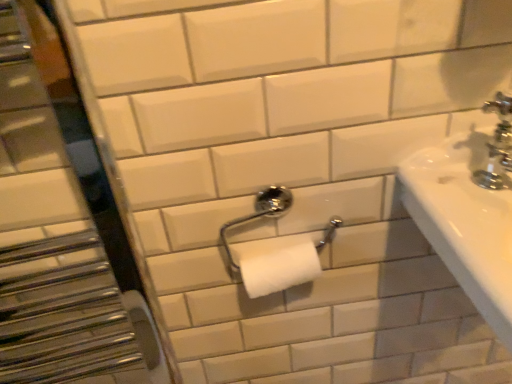
Where is `chrome metallic faucet at upper right`? Image resolution: width=512 pixels, height=384 pixels. chrome metallic faucet at upper right is located at coordinates (497, 145).

Is point (507, 139) in front of point (35, 355)?

That is True.

This screenshot has height=384, width=512. In order to click on mirror that appears below the chrome metallic faucet at upper right (from a real-world perspective) in this screenshot , I will do `click(64, 229)`.

Is chrome metallic faucet at upper right not within brushed metal mirror at left?

Yes, chrome metallic faucet at upper right is not within brushed metal mirror at left.

Is point (3, 35) positioned after point (489, 162)?

No, it is not.

Are brushed metal mirror at left and chrome metallic faucet at upper right beside each other?

No, brushed metal mirror at left is not touching chrome metallic faucet at upper right.

Is brushed metal mirror at left wider than chrome metallic faucet at upper right?

Correct, the width of brushed metal mirror at left exceeds that of chrome metallic faucet at upper right.

From a real-world perspective, which object stands above the other?

In real-world perspective, chrome metallic faucet at upper right is above.

From the image's perspective, between chrome metallic toilet paper holder at center and brushed metal mirror at left, which one is located above?

chrome metallic toilet paper holder at center.

Is chrome metallic toilet paper holder at center facing towards brushed metal mirror at left?

No, chrome metallic toilet paper holder at center is not aimed at brushed metal mirror at left.

Which is behind, chrome metallic toilet paper holder at center or brushed metal mirror at left?

chrome metallic toilet paper holder at center.

Measure the distance between chrome metallic toilet paper holder at center and brushed metal mirror at left.

A distance of 22.59 inches exists between chrome metallic toilet paper holder at center and brushed metal mirror at left.

Are brushed metal mirror at left and chrome metallic toilet paper holder at center far apart?

No, brushed metal mirror at left is not far from chrome metallic toilet paper holder at center.

What's the angular difference between brushed metal mirror at left and chrome metallic toilet paper holder at center's facing directions?

The angle between the facing direction of brushed metal mirror at left and the facing direction of chrome metallic toilet paper holder at center is 0.503 degrees.

Is brushed metal mirror at left looking in the opposite direction of chrome metallic toilet paper holder at center?

brushed metal mirror at left is not turned away from chrome metallic toilet paper holder at center.

Considering the relative sizes of brushed metal mirror at left and chrome metallic toilet paper holder at center in the image provided, is brushed metal mirror at left shorter than chrome metallic toilet paper holder at center?

In fact, brushed metal mirror at left may be taller than chrome metallic toilet paper holder at center.

Can you tell me how much chrome metallic faucet at upper right and chrome metallic toilet paper holder at center differ in facing direction?

1.08 degrees.

Is chrome metallic faucet at upper right wider or thinner than chrome metallic toilet paper holder at center?

chrome metallic faucet at upper right is thinner than chrome metallic toilet paper holder at center.

Does point (507, 100) come in front of point (238, 223)?

Yes, point (507, 100) is closer to viewer.

Does chrome metallic faucet at upper right turn towards chrome metallic toilet paper holder at center?

No, chrome metallic faucet at upper right is not facing towards chrome metallic toilet paper holder at center.

From a real-world perspective, is chrome metallic toilet paper holder at center physically above chrome metallic faucet at upper right?

No, from a real-world perspective, chrome metallic toilet paper holder at center is not above chrome metallic faucet at upper right.

Looking at their sizes, would you say chrome metallic toilet paper holder at center is wider or thinner than chrome metallic faucet at upper right?

Clearly, chrome metallic toilet paper holder at center has more width compared to chrome metallic faucet at upper right.

Can you see chrome metallic toilet paper holder at center touching chrome metallic faucet at upper right?

No, chrome metallic toilet paper holder at center is not with chrome metallic faucet at upper right.

Identify the location of tap that is behind the brushed metal mirror at left. The image size is (512, 384). (497, 145).

Identify the location of mirror located on the left of chrome metallic faucet at upper right. (64, 229).

When comparing their distances from chrome metallic faucet at upper right, does chrome metallic toilet paper holder at center or brushed metal mirror at left seem further?

brushed metal mirror at left is further to chrome metallic faucet at upper right.

Considering their positions, is brushed metal mirror at left positioned further to chrome metallic toilet paper holder at center than chrome metallic faucet at upper right?

Among the two, brushed metal mirror at left is located further to chrome metallic toilet paper holder at center.

From the image, which object appears to be farther from chrome metallic faucet at upper right, brushed metal mirror at left or chrome metallic toilet paper holder at center?

brushed metal mirror at left is positioned further to the anchor chrome metallic faucet at upper right.

Which object lies further to the anchor point brushed metal mirror at left, chrome metallic toilet paper holder at center or chrome metallic faucet at upper right?

chrome metallic faucet at upper right lies further to brushed metal mirror at left than the other object.

Considering their positions, is chrome metallic faucet at upper right positioned closer to chrome metallic toilet paper holder at center than brushed metal mirror at left?

chrome metallic faucet at upper right is closer to chrome metallic toilet paper holder at center.

Estimate the real-world distances between objects in this image. Which object is closer to brushed metal mirror at left, chrome metallic faucet at upper right or chrome metallic toilet paper holder at center?

The object closer to brushed metal mirror at left is chrome metallic toilet paper holder at center.

This screenshot has width=512, height=384. Find the location of `towel bar between brushed metal mirror at left and chrome metallic faucet at upper right from left to right`. towel bar between brushed metal mirror at left and chrome metallic faucet at upper right from left to right is located at coordinates (258, 216).